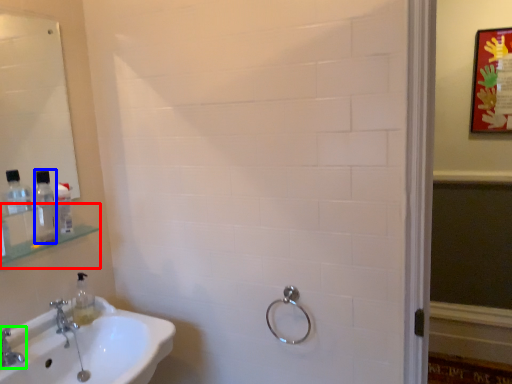
Question: Which object is the farthest from shelf (highlighted by a red box)? Choose among these: mouthwash (highlighted by a blue box) or tap (highlighted by a green box).

Choices:
 (A) mouthwash
 (B) tap

Answer: (B)